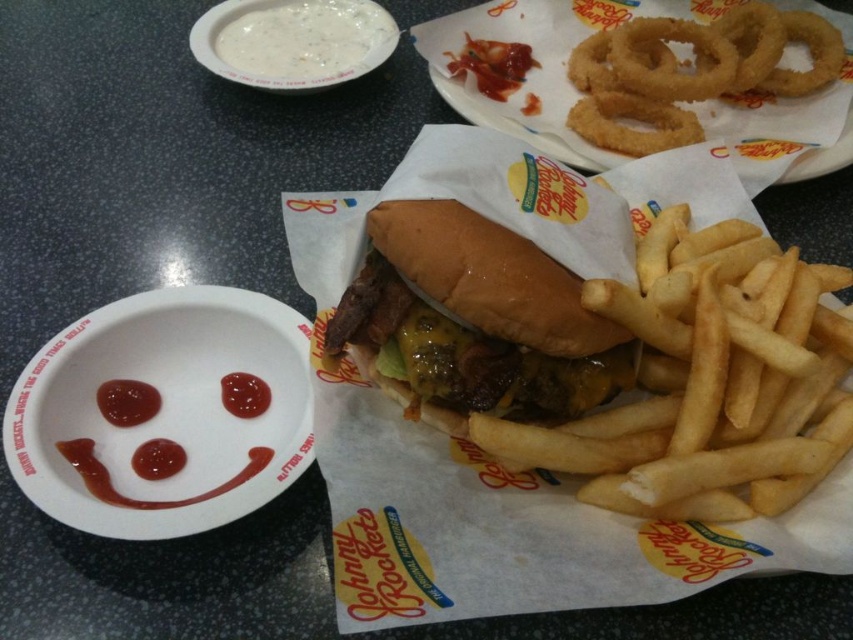
Question: Which of these objects is positioned closest to the slightly toasted bun at center?

Choices:
 (A) golden crispy french fries at center
 (B) matte white paper plate at lower left
 (C) white matte bowl at upper left
 (D) golden brown fried onion rings at upper center

Answer: (A)

Question: Can you confirm if golden crispy french fries at center is thinner than slightly toasted bun at center?

Choices:
 (A) no
 (B) yes

Answer: (A)

Question: Considering the real-world distances, which object is closest to the golden crispy french fries at center?

Choices:
 (A) matte white paper plate at lower left
 (B) golden brown fried onion rings at upper center
 (C) slightly toasted bun at center

Answer: (C)

Question: Which point is closer to the camera?

Choices:
 (A) golden crispy french fries at center
 (B) white matte bowl at upper left

Answer: (A)

Question: Is golden crispy french fries at center above slightly toasted bun at center?

Choices:
 (A) yes
 (B) no

Answer: (B)

Question: Can you confirm if slightly toasted bun at center is positioned below white matte bowl at upper left?

Choices:
 (A) yes
 (B) no

Answer: (A)